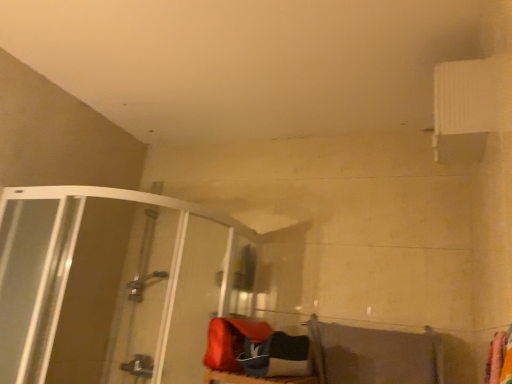
Question: Is transparent glass shower door at left wider than gray fabric beach towel at lower right?

Choices:
 (A) no
 (B) yes

Answer: (B)

Question: Is transparent glass shower door at left oriented towards gray fabric beach towel at lower right?

Choices:
 (A) yes
 (B) no

Answer: (B)

Question: Is transparent glass shower door at left positioned behind gray fabric beach towel at lower right?

Choices:
 (A) yes
 (B) no

Answer: (B)

Question: Can you confirm if transparent glass shower door at left is taller than gray fabric beach towel at lower right?

Choices:
 (A) no
 (B) yes

Answer: (B)

Question: Is transparent glass shower door at left placed right next to gray fabric beach towel at lower right?

Choices:
 (A) no
 (B) yes

Answer: (A)

Question: Is transparent glass shower door at left oriented away from gray fabric beach towel at lower right?

Choices:
 (A) no
 (B) yes

Answer: (A)

Question: Is gray fabric beach towel at lower right positioned beyond the bounds of transparent glass shower door at left?

Choices:
 (A) yes
 (B) no

Answer: (A)

Question: Is gray fabric beach towel at lower right smaller than transparent glass shower door at left?

Choices:
 (A) no
 (B) yes

Answer: (B)

Question: From a real-world perspective, is gray fabric beach towel at lower right located beneath transparent glass shower door at left?

Choices:
 (A) yes
 (B) no

Answer: (A)

Question: Can you confirm if gray fabric beach towel at lower right is bigger than transparent glass shower door at left?

Choices:
 (A) yes
 (B) no

Answer: (B)

Question: Is gray fabric beach towel at lower right to the right of transparent glass shower door at left from the viewer's perspective?

Choices:
 (A) yes
 (B) no

Answer: (A)

Question: From the image's perspective, would you say gray fabric beach towel at lower right is shown under transparent glass shower door at left?

Choices:
 (A) no
 (B) yes

Answer: (B)

Question: Looking at the image, does transparent glass shower door at left seem bigger or smaller compared to gray fabric beach towel at lower right?

Choices:
 (A) big
 (B) small

Answer: (A)